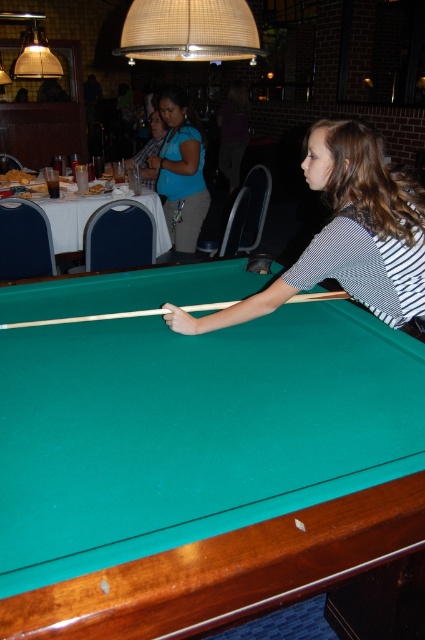
Question: Which point appears closest to the camera in this image?

Choices:
 (A) (176, 218)
 (B) (340, 294)
 (C) (380, 156)
 (D) (36, 496)

Answer: (D)

Question: Which object is the closest to the wooden pool cue at center?

Choices:
 (A) green felt billiard table at center
 (B) striped shirt at center
 (C) matte blue shirt at upper center

Answer: (B)

Question: Can you confirm if striped shirt at center is positioned below wooden pool cue at center?

Choices:
 (A) no
 (B) yes

Answer: (A)

Question: Estimate the real-world distances between objects in this image. Which object is farther from the striped shirt at center?

Choices:
 (A) green felt billiard table at center
 (B) matte blue shirt at upper center

Answer: (B)

Question: Does green felt billiard table at center have a larger size compared to striped shirt at center?

Choices:
 (A) no
 (B) yes

Answer: (B)

Question: Does striped shirt at center appear on the left side of wooden pool cue at center?

Choices:
 (A) yes
 (B) no

Answer: (B)